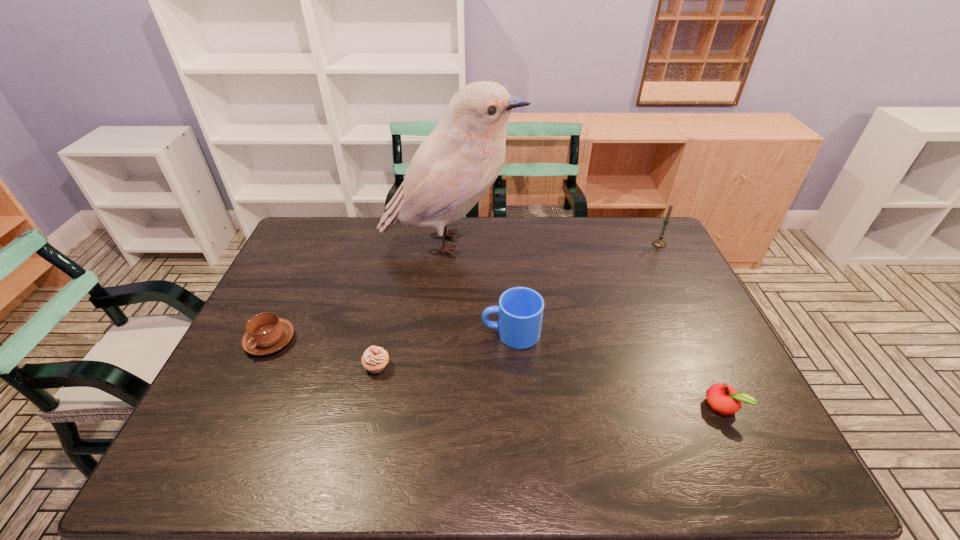
Locate an element on the screen. The image size is (960, 540). free space located 0.170m on the side of the mug with the handle is located at coordinates (420, 333).

At what (x,y) coordinates should I click in order to perform the action: click on free space located on the front of the third shortest object. Please return your answer as a coordinate pair (x, y). The width and height of the screenshot is (960, 540). Looking at the image, I should click on (357, 457).

The image size is (960, 540). I want to click on vacant area located on the side of the cappuccino with the handle, so click(x=237, y=410).

The image size is (960, 540). In order to click on vacant space situated on the left of the apple in this screenshot , I will do `click(675, 406)`.

The width and height of the screenshot is (960, 540). Find the location of `parakeet that is at the far edge`. parakeet that is at the far edge is located at coordinates (454, 167).

I want to click on candle situated at the far edge, so click(x=660, y=243).

This screenshot has height=540, width=960. I want to click on object that is positioned at the left edge, so click(266, 333).

What are the coordinates of `candle positioned at the right edge` in the screenshot? It's located at (660, 243).

Identify the location of apple present at the right edge. The width and height of the screenshot is (960, 540). (724, 399).

The width and height of the screenshot is (960, 540). Find the location of `object present at the far right corner`. object present at the far right corner is located at coordinates (660, 243).